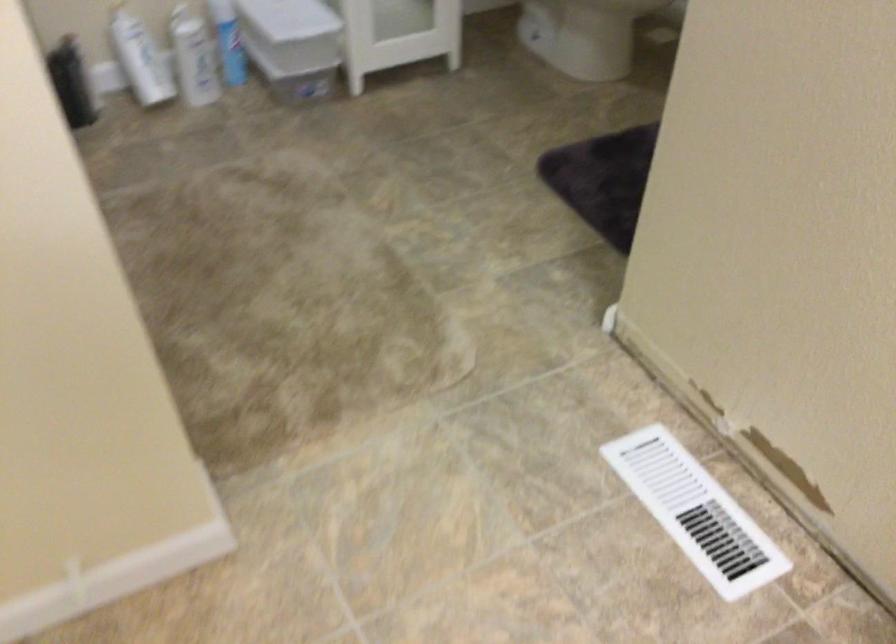
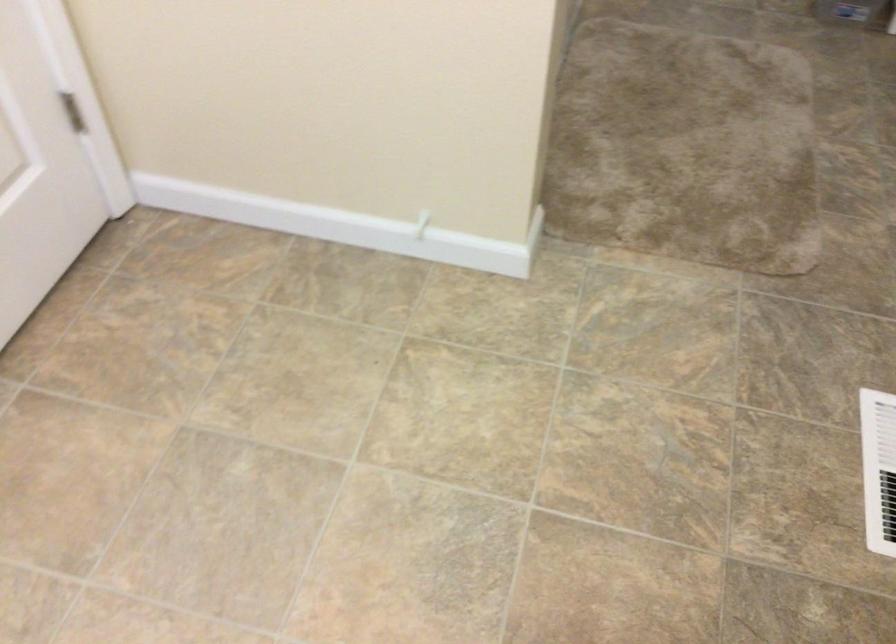
Question: The camera is either moving clockwise (left) or counter-clockwise (right) around the object. The first image is from the beginning of the video and the second image is from the end. Is the camera moving left or right when shooting the video?

Choices:
 (A) Left
 (B) Right

Answer: (B)